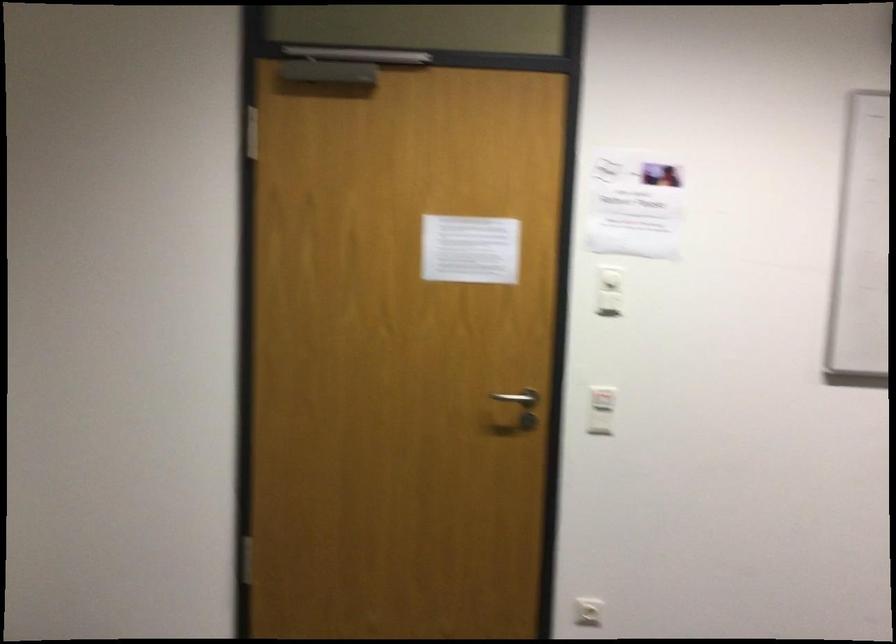
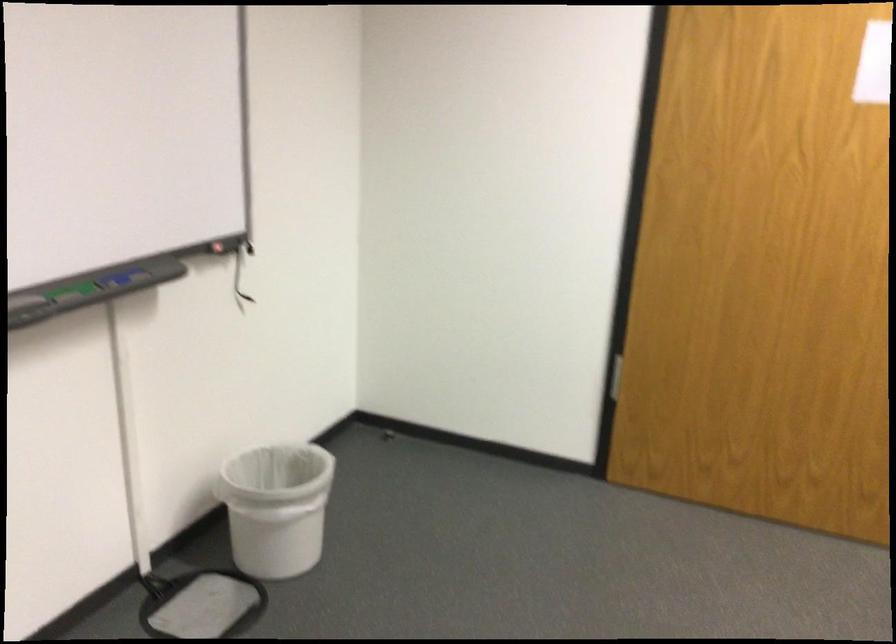
Question: The images are taken continuously from a first-person perspective. In which direction are you moving?

Choices:
 (A) Left
 (B) Right
 (C) Forward
 (D) Backward

Answer: (A)